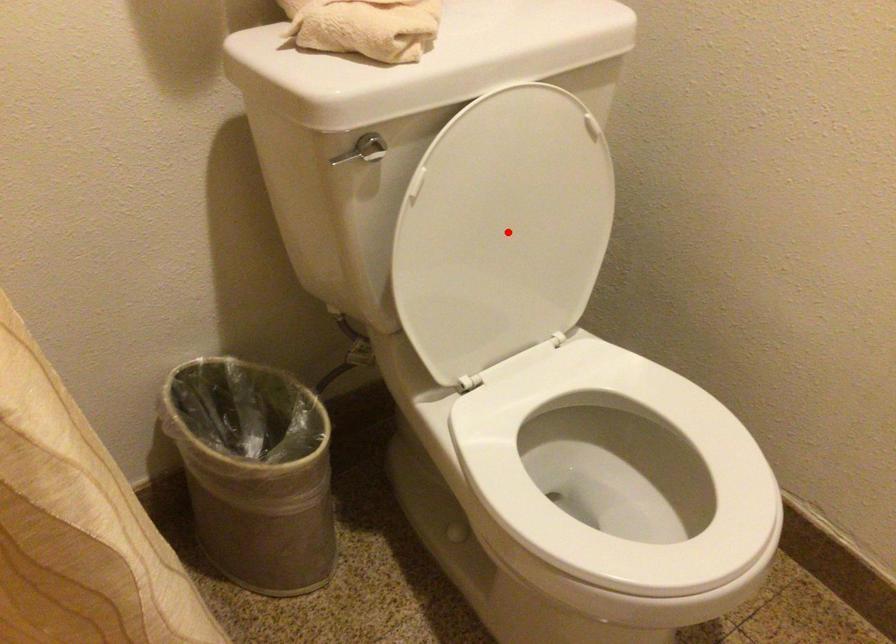
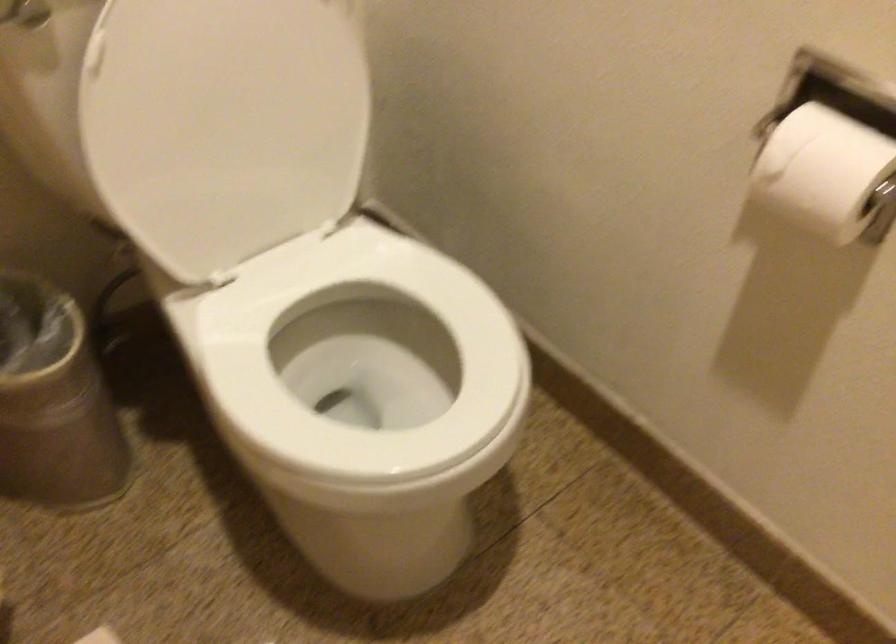
The point at the highlighted location is marked in the first image. Where is the corresponding point in the second image?

(239, 114)